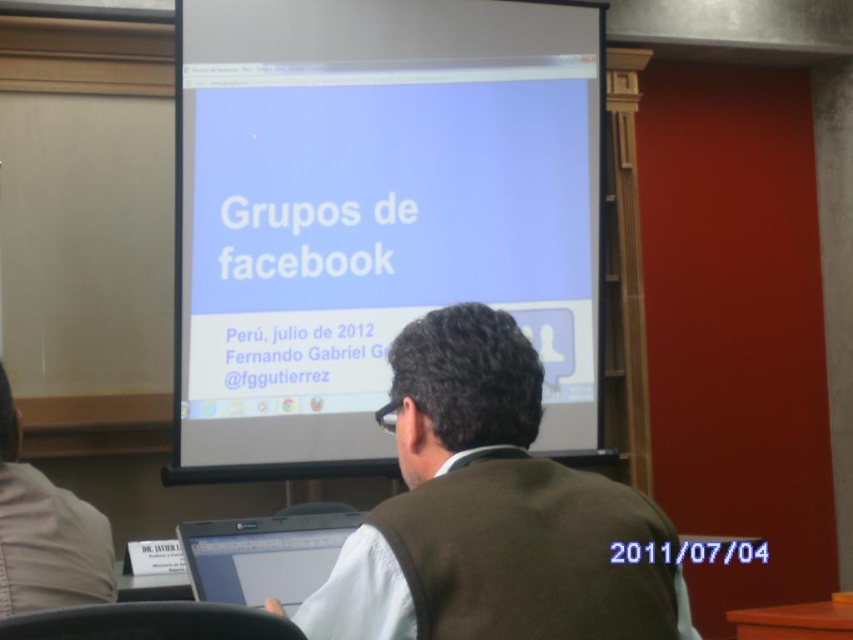
Between brown woolen vest at center and silver metallic laptop at lower center, which one appears on the left side from the viewer's perspective?

From the viewer's perspective, silver metallic laptop at lower center appears more on the left side.

Between point (660, 513) and point (252, 593), which one is positioned in front?

Point (660, 513) is in front.

Is point (434, 600) positioned after point (256, 522)?

No, it is in front of (256, 522).

Find the location of a particular element. brown woolen vest at center is located at coordinates (489, 512).

Does white glossy projector screen at center appear over brown woolen vest at center?

Indeed, white glossy projector screen at center is positioned over brown woolen vest at center.

Can you confirm if white glossy projector screen at center is shorter than brown woolen vest at center?

No.

Does point (285, 387) come farther from viewer compared to point (595, 502)?

That is True.

Image resolution: width=853 pixels, height=640 pixels. What are the coordinates of `white glossy projector screen at center` in the screenshot? It's located at click(x=373, y=214).

Measure the distance between white glossy projector screen at center and camera.

The distance of white glossy projector screen at center from camera is 9.31 feet.

Does white glossy projector screen at center appear over silver metallic laptop at lower center?

Yes.

Between point (402, 182) and point (241, 547), which one is positioned in front?

Point (241, 547) is more forward.

At what (x,y) coordinates should I click in order to perform the action: click on white glossy projector screen at center. Please return your answer as a coordinate pair (x, y). This screenshot has width=853, height=640. Looking at the image, I should click on (373, 214).